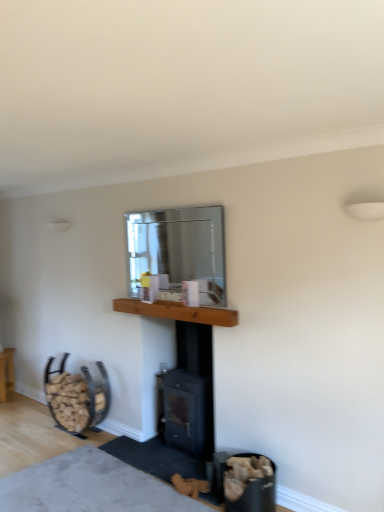
Question: Considering the relative positions of wooden at left and wooden log basket at lower left in the image provided, is wooden at left to the left or to the right of wooden log basket at lower left?

Choices:
 (A) left
 (B) right

Answer: (B)

Question: Does point (102, 413) appear closer or farther from the camera than point (9, 358)?

Choices:
 (A) farther
 (B) closer

Answer: (B)

Question: Based on their relative distances, which object is nearer to the wooden log basket at lower left?

Choices:
 (A) clear glass mirror at upper center
 (B) black matte wood burning stove at center
 (C) soft gray carpet at lower center
 (D) wooden mantle at center
 (E) wooden at left

Answer: (E)

Question: Estimate the real-world distances between objects in this image. Which object is farther from the wooden at left?

Choices:
 (A) black matte wood burning stove at center
 (B) wooden log basket at lower left
 (C) clear glass mirror at upper center
 (D) wooden mantle at center
 (E) soft gray carpet at lower center

Answer: (B)